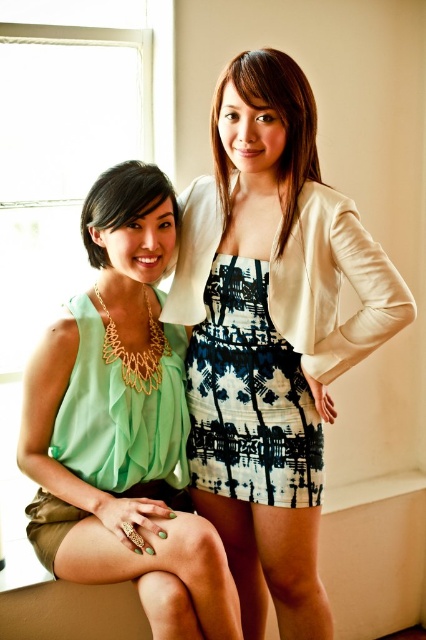
Does mint chiffon dress at lower left have a larger size compared to matte gold necklace at center?

Yes, mint chiffon dress at lower left is bigger than matte gold necklace at center.

Between mint chiffon dress at lower left and matte gold necklace at center, which one has more height?

mint chiffon dress at lower left

Identify the location of mint chiffon dress at lower left. The width and height of the screenshot is (426, 640). (123, 417).

Find the location of a particular element. This screenshot has height=640, width=426. mint chiffon dress at lower left is located at coordinates (123, 417).

Which is more to the right, matte white blazer at center or matte gold necklace at center?

From the viewer's perspective, matte white blazer at center appears more on the right side.

The width and height of the screenshot is (426, 640). I want to click on matte white blazer at center, so click(x=270, y=333).

At what (x,y) coordinates should I click in order to perform the action: click on matte white blazer at center. Please return your answer as a coordinate pair (x, y). This screenshot has height=640, width=426. Looking at the image, I should click on point(270,333).

Can you confirm if printed fabric dress at center is positioned below matte gold necklace at center?

Yes.

Does printed fabric dress at center appear on the right side of matte gold necklace at center?

Correct, you'll find printed fabric dress at center to the right of matte gold necklace at center.

The height and width of the screenshot is (640, 426). What are the coordinates of `printed fabric dress at center` in the screenshot? It's located at (249, 397).